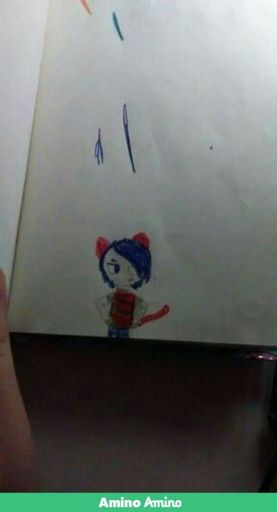
Where is `pen`? Image resolution: width=277 pixels, height=512 pixels. pen is located at coordinates (135, 308).